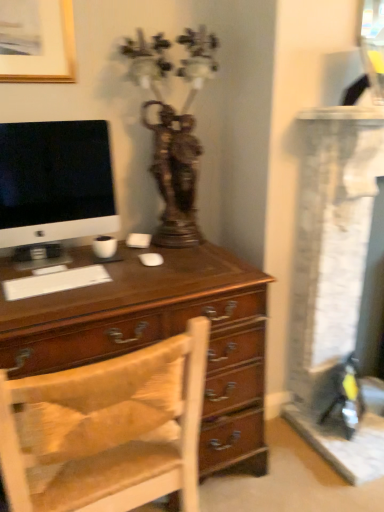
Question: Should I look upward or downward to see antique bronze statue at upper center?

Choices:
 (A) up
 (B) down

Answer: (A)

Question: Can you confirm if matte black monitor at left is thinner than gold-framed picture at upper left?

Choices:
 (A) yes
 (B) no

Answer: (B)

Question: Can you confirm if matte black monitor at left is positioned to the left of gold-framed picture at upper left?

Choices:
 (A) no
 (B) yes

Answer: (A)

Question: Considering the relative sizes of matte black monitor at left and gold-framed picture at upper left in the image provided, is matte black monitor at left bigger than gold-framed picture at upper left?

Choices:
 (A) no
 (B) yes

Answer: (B)

Question: Considering the relative sizes of matte black monitor at left and gold-framed picture at upper left in the image provided, is matte black monitor at left shorter than gold-framed picture at upper left?

Choices:
 (A) yes
 (B) no

Answer: (B)

Question: Is matte black monitor at left positioned before gold-framed picture at upper left?

Choices:
 (A) no
 (B) yes

Answer: (B)

Question: Considering the relative positions of matte black monitor at left and gold-framed picture at upper left in the image provided, is matte black monitor at left behind gold-framed picture at upper left?

Choices:
 (A) no
 (B) yes

Answer: (A)

Question: Can antique bronze statue at upper center be found inside gold-framed picture at upper left?

Choices:
 (A) yes
 (B) no

Answer: (B)

Question: Is gold-framed picture at upper left to the right of antique bronze statue at upper center from the viewer's perspective?

Choices:
 (A) yes
 (B) no

Answer: (B)

Question: From the image's perspective, is gold-framed picture at upper left below antique bronze statue at upper center?

Choices:
 (A) yes
 (B) no

Answer: (B)

Question: From a real-world perspective, is gold-framed picture at upper left positioned over antique bronze statue at upper center based on gravity?

Choices:
 (A) no
 (B) yes

Answer: (B)

Question: Is gold-framed picture at upper left oriented away from antique bronze statue at upper center?

Choices:
 (A) yes
 (B) no

Answer: (B)

Question: Does gold-framed picture at upper left have a greater width compared to antique bronze statue at upper center?

Choices:
 (A) yes
 (B) no

Answer: (B)

Question: Is wooden chair at center smaller than matte black monitor at left?

Choices:
 (A) no
 (B) yes

Answer: (A)